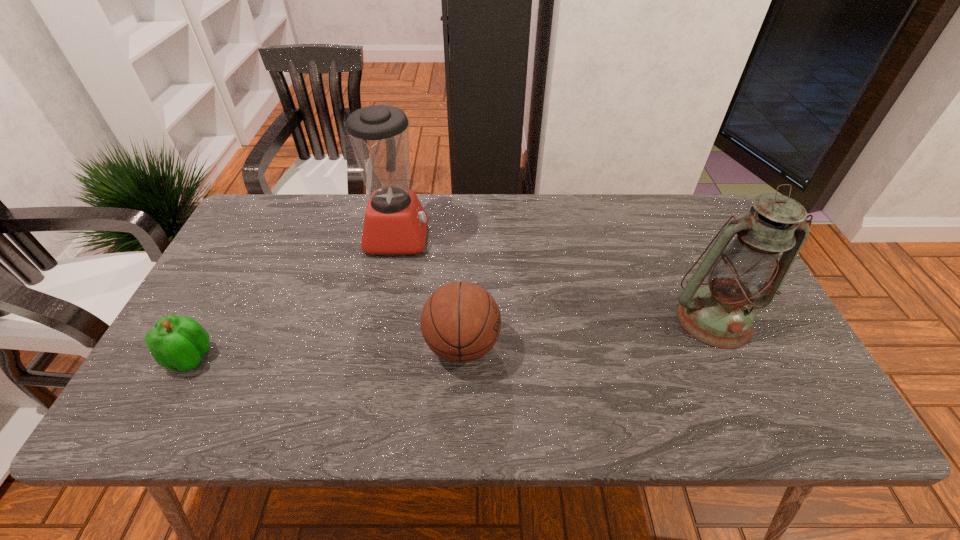
Identify which object is the nearest to the basketball. Please provide its 2D coordinates. Your answer should be formatted as a tuple, i.e. [(x, y)], where the tuple contains the x and y coordinates of a point satisfying the conditions above.

[(395, 222)]

Find the location of a particular element. The image size is (960, 540). vacant space that satisfies the following two spatial constraints: 1. on the front of the second object from left to right near the controls; 2. on the right side of the oil lamp is located at coordinates (381, 319).

Find the location of `vacant space that satisfies the following two spatial constraints: 1. on the front of the second object from left to right near the controls; 2. on the back side of the oil lamp`. vacant space that satisfies the following two spatial constraints: 1. on the front of the second object from left to right near the controls; 2. on the back side of the oil lamp is located at coordinates (381, 319).